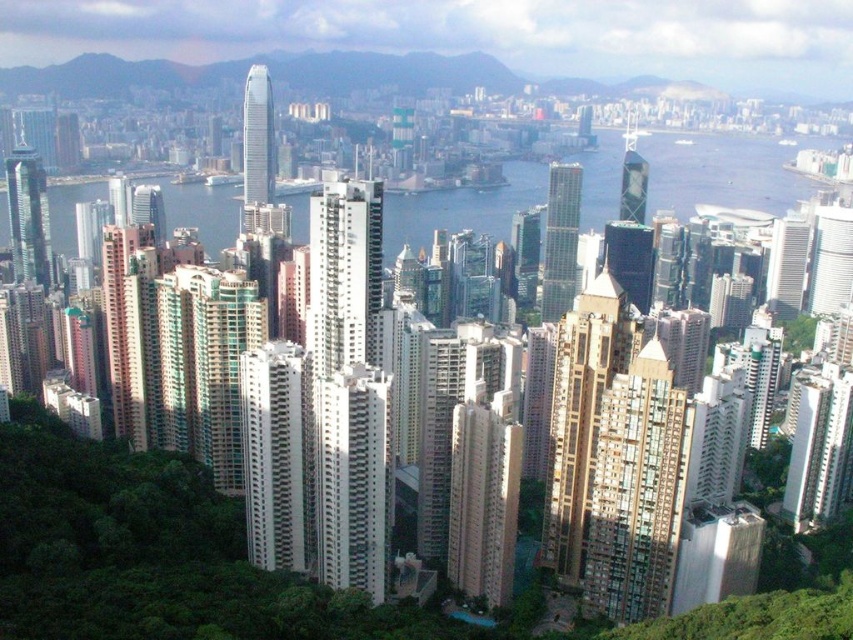
Question: Which object appears farthest from the camera in this image?

Choices:
 (A) white smooth building at center
 (B) green glass skyscraper at center
 (C) brown glassy building at center-right
 (D) matte glass skyscraper at right

Answer: (D)

Question: Is brown glassy building at center-right wider than white smooth building at center?

Choices:
 (A) yes
 (B) no

Answer: (B)

Question: Considering the real-world distances, which object is farthest from the green glass skyscraper at center?

Choices:
 (A) brown glassy building at center-right
 (B) transparent glass water at center
 (C) matte glass skyscraper at center
 (D) glassy reflective skyscraper at center-right

Answer: (A)

Question: Considering the relative positions of gold textured building at center and shiny glass skyscraper at left in the image provided, where is gold textured building at center located with respect to shiny glass skyscraper at left?

Choices:
 (A) left
 (B) right

Answer: (B)

Question: Which point appears farthest from the camera in this image?

Choices:
 (A) (785, 198)
 (B) (625, 193)

Answer: (A)

Question: Can you confirm if brown glassy building at center-right is positioned above glassy reflective skyscraper at center-right?

Choices:
 (A) no
 (B) yes

Answer: (A)